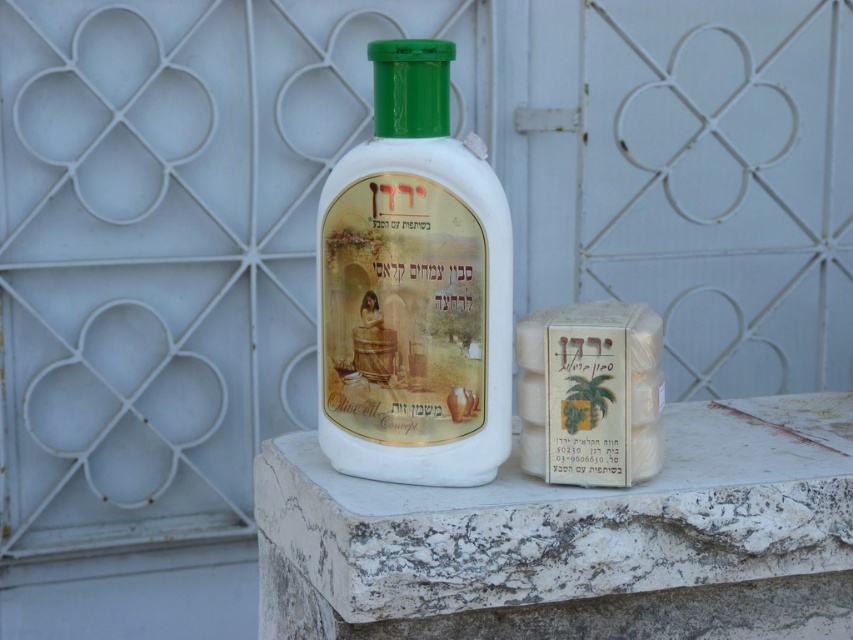
From the picture: You are a photographer setting up a shot of the white marble at center. Your camera is 4.01 feet away from the marble. Can you capture the entire marble in your photo without moving the camera?

The white marble at center and camera are 4.01 feet apart, so the distance is sufficient to capture the entire marble in the photo without moving the camera.

You are organizing items on a table and see the white marble at center and the white matte bottle at center. Which object is located to the right of the other?

The white marble at center is positioned on the right side of white matte bottle at center, so the white marble at center is to the right of the white matte bottle at center.